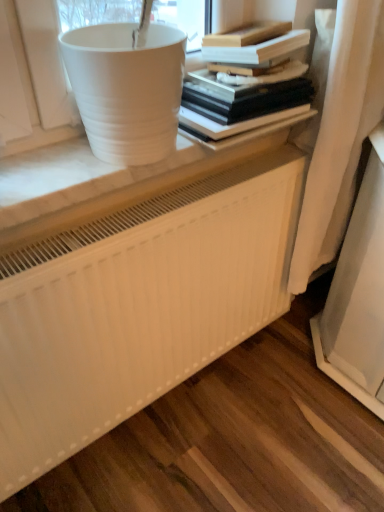
Question: Should I look upward or downward to see hardcover books at upper center?

Choices:
 (A) up
 (B) down

Answer: (A)